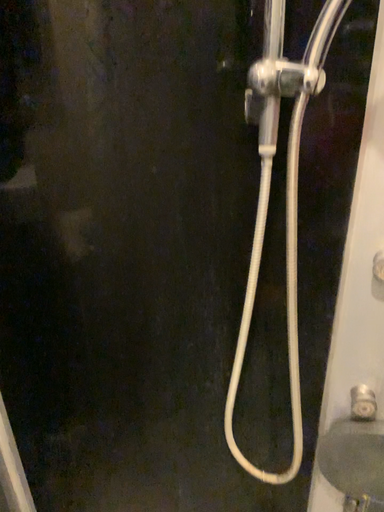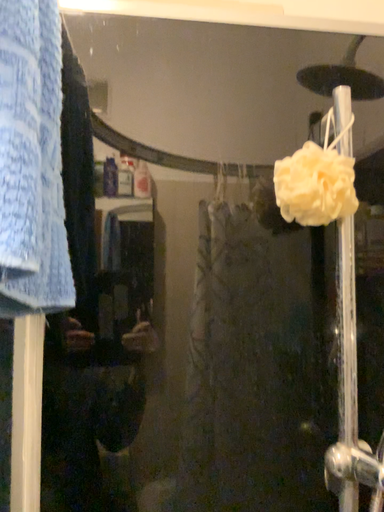
Question: How did the camera likely rotate when shooting the video?

Choices:
 (A) rotated right
 (B) rotated left

Answer: (B)